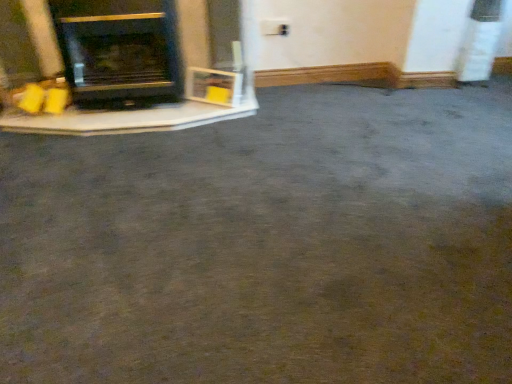
At what (x,y) coordinates should I click in order to perform the action: click on matte black fireplace at left. Please return your answer as a coordinate pair (x, y). The width and height of the screenshot is (512, 384). Looking at the image, I should click on (138, 116).

The width and height of the screenshot is (512, 384). Describe the element at coordinates (138, 116) in the screenshot. I see `matte black fireplace at left` at that location.

Find the location of a particular element. black matte wood burning stove at left is located at coordinates coord(119,51).

Image resolution: width=512 pixels, height=384 pixels. What do you see at coordinates (119, 51) in the screenshot?
I see `black matte wood burning stove at left` at bounding box center [119, 51].

You are a GUI agent. You are given a task and a screenshot of the screen. Output one action in this format:
    pyautogui.click(x=<x>, y=<y>)
    Task: Click on the matte black fireplace at left
    This screenshot has height=384, width=512.
    Given the screenshot: What is the action you would take?
    pyautogui.click(x=138, y=116)

Which object is positioned more to the left, black matte wood burning stove at left or matte black fireplace at left?

Positioned to the left is matte black fireplace at left.

Is black matte wood burning stove at left further to camera compared to matte black fireplace at left?

No.

Which point is more forward, (85, 97) or (213, 71)?

Positioned in front is point (85, 97).

From the image's perspective, does black matte wood burning stove at left appear higher than matte black fireplace at left?

No, from the image's perspective, black matte wood burning stove at left is not above matte black fireplace at left.

From a real-world perspective, is black matte wood burning stove at left beneath matte black fireplace at left?

No, from a real-world perspective, black matte wood burning stove at left is not beneath matte black fireplace at left.

Between black matte wood burning stove at left and matte black fireplace at left, which one has larger width?

With larger width is black matte wood burning stove at left.

Is black matte wood burning stove at left taller than matte black fireplace at left?

Correct, black matte wood burning stove at left is much taller as matte black fireplace at left.

Can you confirm if black matte wood burning stove at left is bigger than matte black fireplace at left?

No, black matte wood burning stove at left is not bigger than matte black fireplace at left.

Would you say black matte wood burning stove at left is inside or outside matte black fireplace at left?

The correct answer is: inside.

Is black matte wood burning stove at left directly adjacent to matte black fireplace at left?

They are not placed beside each other.

Is black matte wood burning stove at left positioned with its back to matte black fireplace at left?

Yes, black matte wood burning stove at left is positioned with its back facing matte black fireplace at left.

This screenshot has height=384, width=512. Find the location of `fireplace on the left of black matte wood burning stove at left`. fireplace on the left of black matte wood burning stove at left is located at coordinates (138, 116).

Between matte black fireplace at left and black matte wood burning stove at left, which one appears on the right side from the viewer's perspective?

black matte wood burning stove at left.

Which object is further away from the camera, matte black fireplace at left or black matte wood burning stove at left?

matte black fireplace at left is behind.

Which point is more forward, (89, 135) or (82, 52)?

The point (82, 52) is in front.

From the image's perspective, would you say matte black fireplace at left is shown under black matte wood burning stove at left?

No, from the image's perspective, matte black fireplace at left is not below black matte wood burning stove at left.

From a real-world perspective, is matte black fireplace at left physically located above or below black matte wood burning stove at left?

In terms of real-world spatial position, matte black fireplace at left is below black matte wood burning stove at left.

Which object is wider, matte black fireplace at left or black matte wood burning stove at left?

black matte wood burning stove at left.

Is matte black fireplace at left taller or shorter than black matte wood burning stove at left?

Considering their sizes, matte black fireplace at left has less height than black matte wood burning stove at left.

Consider the image. Considering the sizes of matte black fireplace at left and black matte wood burning stove at left in the image, is matte black fireplace at left bigger or smaller than black matte wood burning stove at left?

Clearly, matte black fireplace at left is larger in size than black matte wood burning stove at left.

Choose the correct answer: Is matte black fireplace at left inside black matte wood burning stove at left or outside it?

matte black fireplace at left is enclosed within black matte wood burning stove at left.

Is matte black fireplace at left positioned far away from black matte wood burning stove at left?

No, matte black fireplace at left is not far from black matte wood burning stove at left.

Is matte black fireplace at left oriented towards black matte wood burning stove at left?

Yes, matte black fireplace at left is facing black matte wood burning stove at left.

How distant is matte black fireplace at left from black matte wood burning stove at left?

matte black fireplace at left is 10.59 inches away from black matte wood burning stove at left.

You are a GUI agent. You are given a task and a screenshot of the screen. Output one action in this format:
    pyautogui.click(x=<x>, y=<y>)
    Task: Click on the wood burning stove lying below the matte black fireplace at left (from the image's perspective)
    The width and height of the screenshot is (512, 384).
    Given the screenshot: What is the action you would take?
    pyautogui.click(x=119, y=51)

Where is `wood burning stove in front of the matte black fireplace at left`? This screenshot has height=384, width=512. wood burning stove in front of the matte black fireplace at left is located at coordinates (119, 51).

The width and height of the screenshot is (512, 384). I want to click on fireplace below the black matte wood burning stove at left (from a real-world perspective), so click(138, 116).